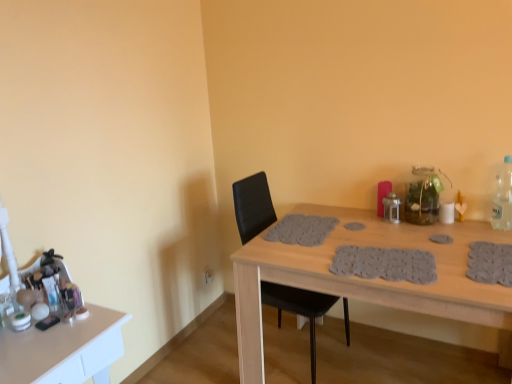
Describe the element at coordinates (369, 280) in the screenshot. The width and height of the screenshot is (512, 384). I see `wooden table at center, the first table positioned from the right` at that location.

Image resolution: width=512 pixels, height=384 pixels. I want to click on wooden table at center, the first table positioned from the right, so click(x=369, y=280).

Image resolution: width=512 pixels, height=384 pixels. Describe the element at coordinates (503, 197) in the screenshot. I see `clear plastic bottle at right` at that location.

Find the location of a particular element. This screenshot has height=384, width=512. white glossy makeup at left, arranged as the second table when viewed from the right is located at coordinates (64, 350).

You are a GUI agent. You are given a task and a screenshot of the screen. Output one action in this format:
    pyautogui.click(x=<x>, y=<y>)
    Task: Click on the table below the white glossy makeup at left, arranged as the second table when viewed from the right (from a real-world perspective)
    The image size is (512, 384).
    Given the screenshot: What is the action you would take?
    pyautogui.click(x=369, y=280)

Is white glossy makeup at left, the 1th table in the left-to-right sequence, not inside wooden table at center, the second table positioned from the left?

white glossy makeup at left, the 1th table in the left-to-right sequence, lies outside wooden table at center, the second table positioned from the left,'s area.

Based on the photo, would you consider white glossy makeup at left, arranged as the second table when viewed from the right, to be distant from wooden table at center, the first table positioned from the right?

white glossy makeup at left, arranged as the second table when viewed from the right, is near wooden table at center, the first table positioned from the right, not far away.

Consider the image. From a real-world perspective, which is physically above, white glossy makeup at left, arranged as the second table when viewed from the right, or wooden table at center, the second table positioned from the left?

In real-world perspective, white glossy makeup at left, arranged as the second table when viewed from the right, is above.

Who is shorter, clear plastic bottle at right or white glossy makeup at left, the 1th table in the left-to-right sequence?

With less height is clear plastic bottle at right.

Is clear plastic bottle at right placed right next to white glossy makeup at left, arranged as the second table when viewed from the right?

They are not placed beside each other.

Find the location of `bottle above the white glossy makeup at left, the 1th table in the left-to-right sequence (from the image's perspective)`. bottle above the white glossy makeup at left, the 1th table in the left-to-right sequence (from the image's perspective) is located at coordinates (503, 197).

From a real-world perspective, between clear plastic bottle at right and wooden table at center, the first table positioned from the right, who is vertically lower?

In real-world perspective, wooden table at center, the first table positioned from the right, is lower.

Between clear plastic bottle at right and wooden table at center, the first table positioned from the right, which one has less height?

clear plastic bottle at right.

Relative to wooden table at center, the first table positioned from the right, is clear plastic bottle at right in front or behind?

Visually, clear plastic bottle at right is located behind wooden table at center, the first table positioned from the right.

Does clear plastic bottle at right touch wooden table at center, the second table positioned from the left?

No, clear plastic bottle at right is not next to wooden table at center, the second table positioned from the left.

Do you think white glossy makeup at left, the 1th table in the left-to-right sequence, is within black leather chair at center, or outside of it?

white glossy makeup at left, the 1th table in the left-to-right sequence, cannot be found inside black leather chair at center.

Which object is closer to the camera, white glossy makeup at left, arranged as the second table when viewed from the right, or black leather chair at center?

white glossy makeup at left, arranged as the second table when viewed from the right, is more forward.

How different are the orientations of white glossy makeup at left, the 1th table in the left-to-right sequence, and black leather chair at center in degrees?

The facing directions of white glossy makeup at left, the 1th table in the left-to-right sequence, and black leather chair at center are 4.94 degrees apart.

Do you think black leather chair at center is within wooden table at center, the first table positioned from the right, or outside of it?

black leather chair at center is spatially positioned inside wooden table at center, the first table positioned from the right.

Which of these two, black leather chair at center or wooden table at center, the second table positioned from the left, is wider?

With larger width is wooden table at center, the second table positioned from the left.

Which is more to the left, black leather chair at center or wooden table at center, the second table positioned from the left?

black leather chair at center is more to the left.

From the image's perspective, is black leather chair at center on top of white glossy makeup at left, the 1th table in the left-to-right sequence?

Yes, from the image's perspective, black leather chair at center is on top of white glossy makeup at left, the 1th table in the left-to-right sequence.

Choose the correct answer: Is black leather chair at center inside white glossy makeup at left, arranged as the second table when viewed from the right, or outside it?

black leather chair at center exists outside the volume of white glossy makeup at left, arranged as the second table when viewed from the right.

From a real-world perspective, is black leather chair at center positioned under white glossy makeup at left, the 1th table in the left-to-right sequence, based on gravity?

No.

Can you confirm if black leather chair at center is thinner than white glossy makeup at left, arranged as the second table when viewed from the right?

No, black leather chair at center is not thinner than white glossy makeup at left, arranged as the second table when viewed from the right.

Looking at this image, is white glossy makeup at left, the 1th table in the left-to-right sequence, bigger than clear plastic bottle at right?

Yes, white glossy makeup at left, the 1th table in the left-to-right sequence, is bigger than clear plastic bottle at right.

Locate an element on the screen. bottle above the white glossy makeup at left, the 1th table in the left-to-right sequence (from the image's perspective) is located at coordinates (503, 197).

Is white glossy makeup at left, the 1th table in the left-to-right sequence, wider than clear plastic bottle at right?

Correct, the width of white glossy makeup at left, the 1th table in the left-to-right sequence, exceeds that of clear plastic bottle at right.

Find the location of `table lying on the left of wooden table at center, the first table positioned from the right`. table lying on the left of wooden table at center, the first table positioned from the right is located at coordinates (64, 350).

From the clear plastic bottle at right, count 2nd tables forward and point to it. Please provide its 2D coordinates.

[(64, 350)]

From the image, which object appears to be nearer to wooden table at center, the first table positioned from the right, black leather chair at center or white glossy makeup at left, the 1th table in the left-to-right sequence?

black leather chair at center is positioned closer to the anchor wooden table at center, the first table positioned from the right.

Estimate the real-world distances between objects in this image. Which object is further from clear plastic bottle at right, white glossy makeup at left, arranged as the second table when viewed from the right, or wooden table at center, the second table positioned from the left?

white glossy makeup at left, arranged as the second table when viewed from the right, lies further to clear plastic bottle at right than the other object.

From the image, which object appears to be farther from wooden table at center, the first table positioned from the right, white glossy makeup at left, arranged as the second table when viewed from the right, or black leather chair at center?

Among the two, white glossy makeup at left, arranged as the second table when viewed from the right, is located further to wooden table at center, the first table positioned from the right.

Which object lies nearer to the anchor point black leather chair at center, wooden table at center, the second table positioned from the left, or clear plastic bottle at right?

wooden table at center, the second table positioned from the left.

Estimate the real-world distances between objects in this image. Which object is closer to black leather chair at center, wooden table at center, the first table positioned from the right, or white glossy makeup at left, arranged as the second table when viewed from the right?

wooden table at center, the first table positioned from the right, is closer to black leather chair at center.

Considering their positions, is white glossy makeup at left, the 1th table in the left-to-right sequence, positioned further to black leather chair at center than wooden table at center, the first table positioned from the right?

white glossy makeup at left, the 1th table in the left-to-right sequence.

Consider the image. Which object lies further to the anchor point wooden table at center, the first table positioned from the right, black leather chair at center or clear plastic bottle at right?

Based on the image, clear plastic bottle at right appears to be further to wooden table at center, the first table positioned from the right.

Which object lies nearer to the anchor point clear plastic bottle at right, black leather chair at center or wooden table at center, the first table positioned from the right?

wooden table at center, the first table positioned from the right, lies closer to clear plastic bottle at right than the other object.

Locate an element on the screen. This screenshot has width=512, height=384. table between black leather chair at center and clear plastic bottle at right is located at coordinates (369, 280).

You are a GUI agent. You are given a task and a screenshot of the screen. Output one action in this format:
    pyautogui.click(x=<x>, y=<y>)
    Task: Click on the chair located between white glossy makeup at left, the 1th table in the left-to-right sequence, and clear plastic bottle at right in the left-right direction
    
    Given the screenshot: What is the action you would take?
    pyautogui.click(x=253, y=206)

The image size is (512, 384). What are the coordinates of `chair between white glossy makeup at left, the 1th table in the left-to-right sequence, and wooden table at center, the first table positioned from the right` in the screenshot? It's located at (253, 206).

The image size is (512, 384). I want to click on table between white glossy makeup at left, the 1th table in the left-to-right sequence, and clear plastic bottle at right, in the horizontal direction, so click(x=369, y=280).